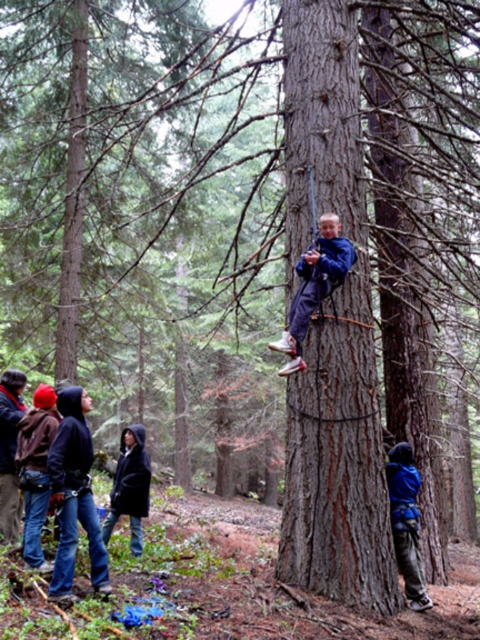
Question: Among these objects, which one is nearest to the camera?

Choices:
 (A) dark blue hoodie at center
 (B) blue fleece jacket at center

Answer: (B)

Question: Which point is closer to the camera?

Choices:
 (A) (x=324, y=259)
 (B) (x=300, y=138)
 (C) (x=16, y=424)

Answer: (A)

Question: Considering the relative positions of brown rough tree trunk at center and brushed metal jacket at lower left in the image provided, where is brown rough tree trunk at center located with respect to brushed metal jacket at lower left?

Choices:
 (A) left
 (B) right

Answer: (B)

Question: Which point appears farthest from the camera in this image?

Choices:
 (A) (124, 436)
 (B) (304, 368)
 (C) (16, 483)
 (D) (294, 129)

Answer: (A)

Question: Where is brown rough tree trunk at center located in relation to blue fleece jacket at center in the image?

Choices:
 (A) above
 (B) below

Answer: (A)

Question: Can you confirm if blue fleece jacket at center is wider than brushed metal jacket at lower left?

Choices:
 (A) yes
 (B) no

Answer: (A)